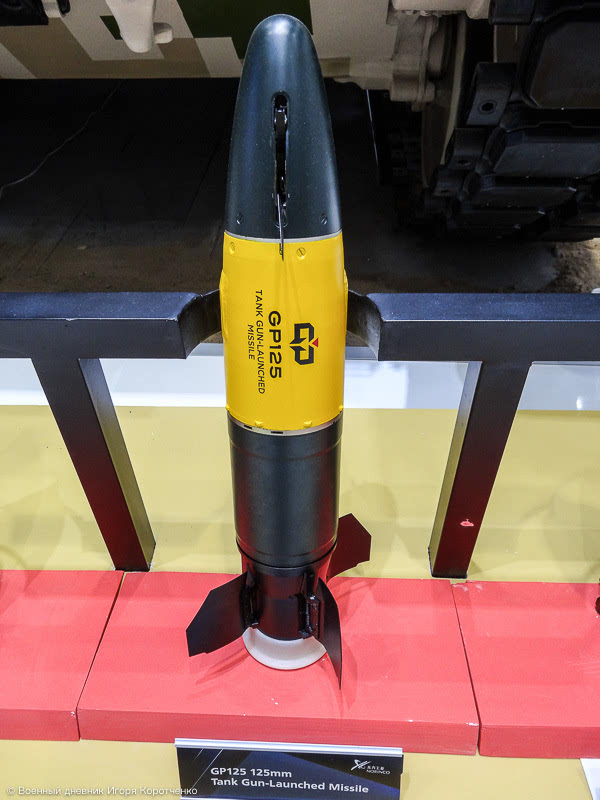
The height and width of the screenshot is (800, 600). I want to click on wooden stands, so click(472, 478), click(75, 386).